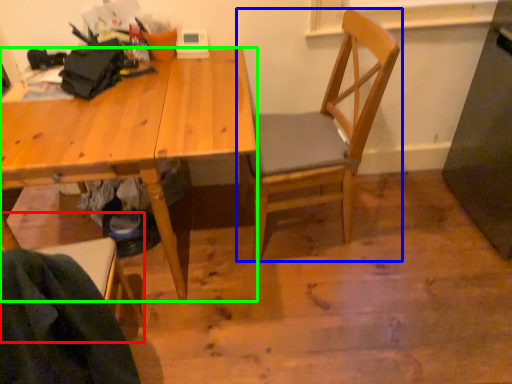
Question: Which is nearer to the chair (highlighted by a red box)? chair (highlighted by a blue box) or desk (highlighted by a green box).

Choices:
 (A) chair
 (B) desk

Answer: (B)